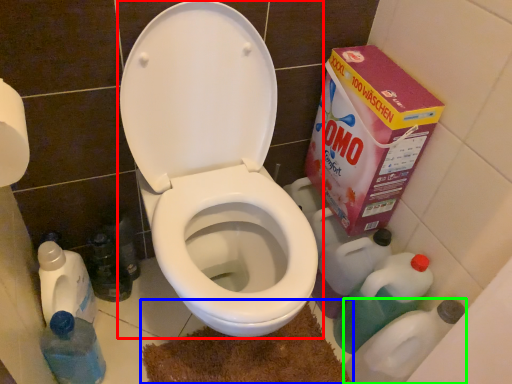
Question: Which object is positioned closest to toilet (highlighted by a red box)? Select from bath mat (highlighted by a blue box) and cleaning product (highlighted by a green box).

Choices:
 (A) bath mat
 (B) cleaning product

Answer: (A)